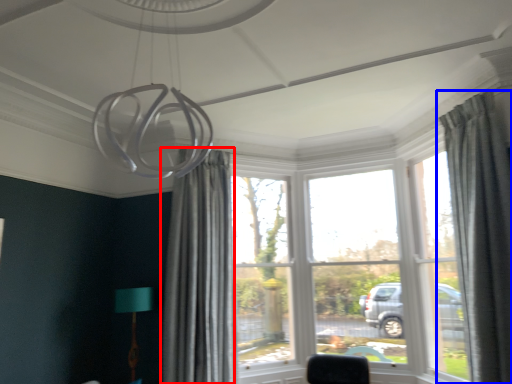
Question: Which object is further to the camera taking this photo, curtain (highlighted by a red box) or curtain (highlighted by a blue box)?

Choices:
 (A) curtain
 (B) curtain

Answer: (A)